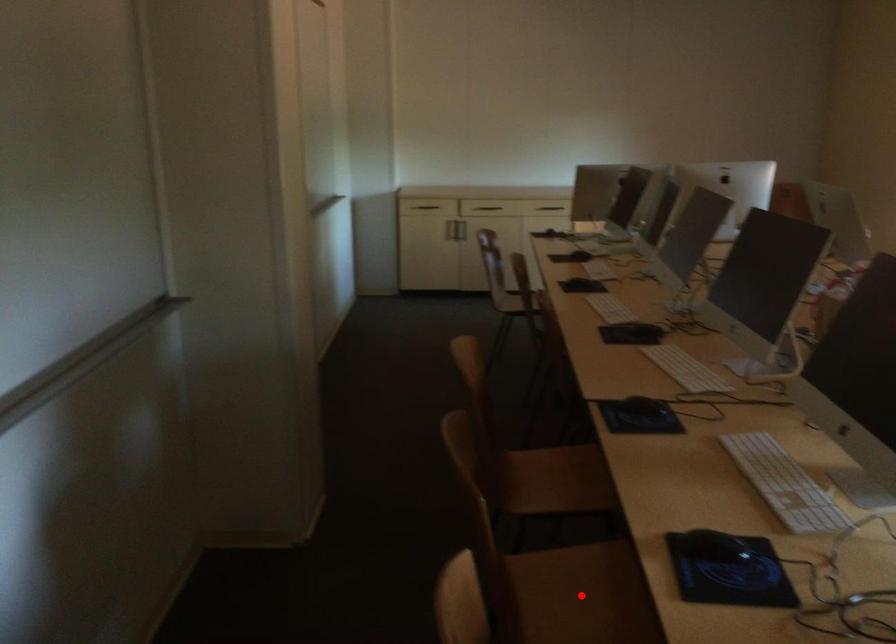
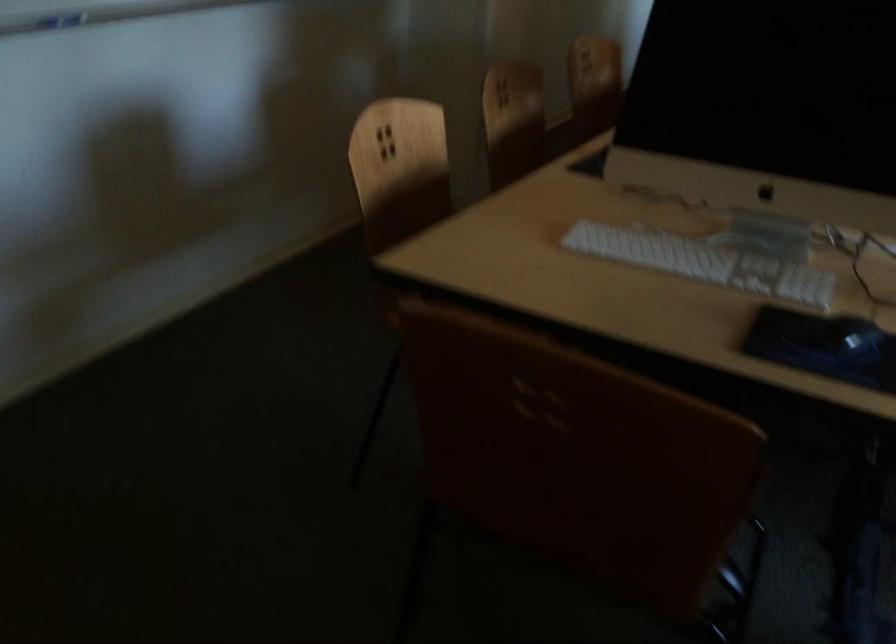
Question: I am providing you with two images of the same scene from different viewpoints. A red point is marked on the first image. Can you still see the location of the red point in image 2?

Choices:
 (A) Yes
 (B) No

Answer: (B)